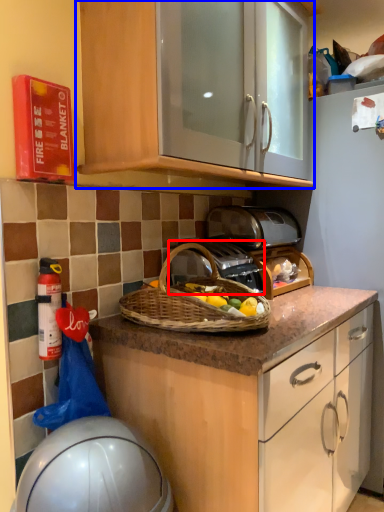
Question: Among these objects, which one is nearest to the camera, gas stove (highlighted by a red box) or cabinetry (highlighted by a blue box)?

Choices:
 (A) gas stove
 (B) cabinetry

Answer: (B)